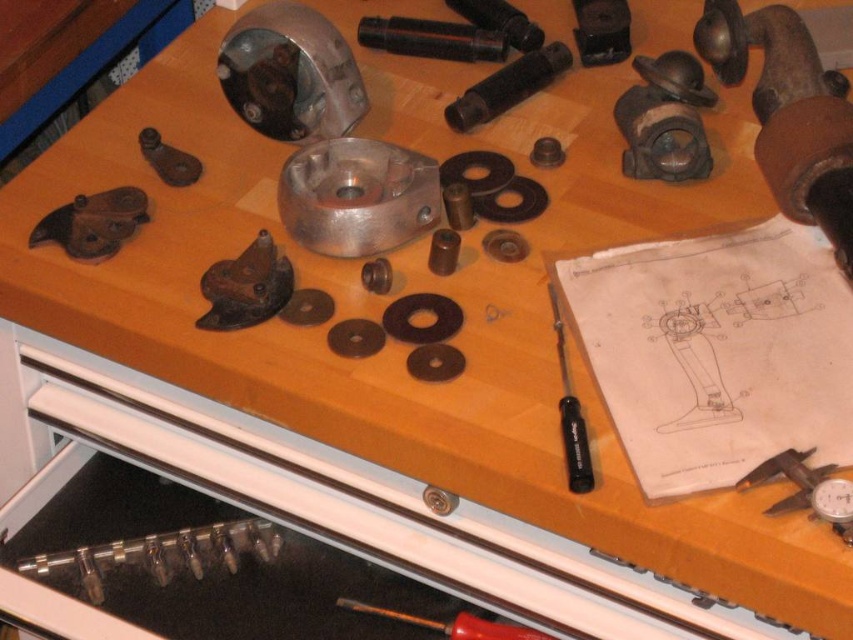
Does point (799, 500) come closer to viewer compared to point (573, 470)?

Yes, it is in front of point (573, 470).

Who is higher up, metallic gauge at lower right or black plastic screwdriver at center-right?

black plastic screwdriver at center-right is higher up.

Between point (782, 460) and point (552, 291), which one is positioned behind?

The point (552, 291) is behind.

The width and height of the screenshot is (853, 640). I want to click on metallic gauge at lower right, so click(x=805, y=490).

Who is more forward, (576, 397) or (424, 492)?

Point (576, 397) is in front.

Can you confirm if black plastic screwdriver at center-right is wider than metallic silver bolt at center?

No, black plastic screwdriver at center-right is not wider than metallic silver bolt at center.

Who is more distant from viewer, (560, 348) or (436, 504)?

The point (560, 348) is behind.

Identify the location of black plastic screwdriver at center-right. (570, 413).

Between metallic gauge at lower right and metallic silver bolt at center, which one appears on the right side from the viewer's perspective?

metallic gauge at lower right is more to the right.

How far apart are metallic gauge at lower right and metallic silver bolt at center?

They are 29.25 centimeters apart.

Does point (782, 509) come in front of point (426, 492)?

Yes, point (782, 509) is closer to viewer.

What are the coordinates of `metallic gauge at lower right` in the screenshot? It's located at (805, 490).